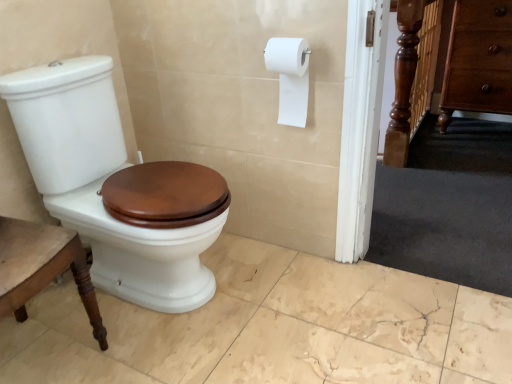
Question: Would you say white glossy toilet at left contains brown wood drawer at right?

Choices:
 (A) no
 (B) yes

Answer: (A)

Question: Is the position of white glossy toilet at left more distant than that of brown wood drawer at right?

Choices:
 (A) no
 (B) yes

Answer: (A)

Question: Is white glossy toilet at left smaller than brown wood drawer at right?

Choices:
 (A) no
 (B) yes

Answer: (A)

Question: Are white glossy toilet at left and brown wood drawer at right far apart?

Choices:
 (A) no
 (B) yes

Answer: (B)

Question: Considering the relative sizes of white glossy toilet at left and brown wood drawer at right in the image provided, is white glossy toilet at left taller than brown wood drawer at right?

Choices:
 (A) no
 (B) yes

Answer: (A)

Question: From a real-world perspective, is white glossy toilet at left positioned above or below brown wood drawer at right?

Choices:
 (A) above
 (B) below

Answer: (B)

Question: Visually, is white glossy toilet at left positioned to the left or to the right of brown wood drawer at right?

Choices:
 (A) left
 (B) right

Answer: (A)

Question: From the image's perspective, is white glossy toilet at left positioned above or below brown wood drawer at right?

Choices:
 (A) above
 (B) below

Answer: (B)

Question: Considering the positions of white glossy toilet at left and brown wood drawer at right in the image, is white glossy toilet at left wider or thinner than brown wood drawer at right?

Choices:
 (A) thin
 (B) wide

Answer: (B)

Question: Is white matte toilet paper at upper right taller or shorter than white glossy toilet at left?

Choices:
 (A) tall
 (B) short

Answer: (B)

Question: From a real-world perspective, relative to white glossy toilet at left, is white matte toilet paper at upper right vertically above or below?

Choices:
 (A) below
 (B) above

Answer: (B)

Question: From the image's perspective, is white matte toilet paper at upper right located above or below white glossy toilet at left?

Choices:
 (A) below
 (B) above

Answer: (B)

Question: Is point (295, 66) closer or farther from the camera than point (45, 119)?

Choices:
 (A) farther
 (B) closer

Answer: (A)

Question: Considering the positions of white matte toilet paper at upper right and brown wood drawer at right in the image, is white matte toilet paper at upper right bigger or smaller than brown wood drawer at right?

Choices:
 (A) big
 (B) small

Answer: (B)

Question: In terms of height, does white matte toilet paper at upper right look taller or shorter compared to brown wood drawer at right?

Choices:
 (A) tall
 (B) short

Answer: (B)